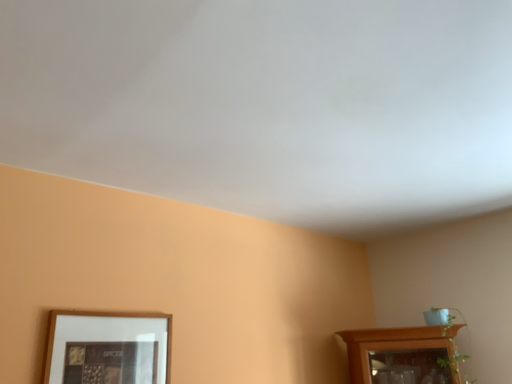
This screenshot has height=384, width=512. Describe the element at coordinates (108, 348) in the screenshot. I see `wooden framed picture at lower left` at that location.

The width and height of the screenshot is (512, 384). What are the coordinates of `wooden framed picture at lower left` in the screenshot? It's located at (108, 348).

Find the location of a particular element. The width and height of the screenshot is (512, 384). wooden framed picture at lower left is located at coordinates (108, 348).